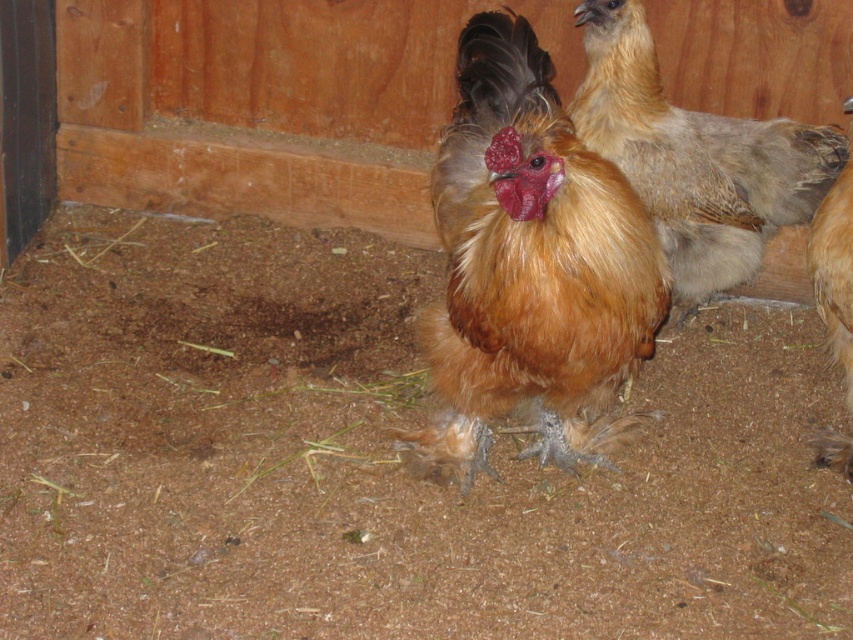
Does golden brown feathered rooster at center have a greater height compared to brown fluffy chicken at right?

Correct, golden brown feathered rooster at center is much taller as brown fluffy chicken at right.

In the scene shown: Who is higher up, golden brown feathered rooster at center or brown fluffy chicken at right?

golden brown feathered rooster at center

Find the location of a particular element. golden brown feathered rooster at center is located at coordinates (531, 268).

Between point (479, 300) and point (593, 115), which one is positioned in front?

Point (479, 300) is in front.

Is point (509, 74) positioned after point (715, 141)?

No, (509, 74) is closer to viewer.

Which is in front, point (608, 348) or point (735, 202)?

Point (608, 348) is in front.

You are a GUI agent. You are given a task and a screenshot of the screen. Output one action in this format:
    pyautogui.click(x=<x>, y=<y>)
    Task: Click on the golden brown feathered rooster at center
    Image resolution: width=853 pixels, height=640 pixels.
    Given the screenshot: What is the action you would take?
    pyautogui.click(x=531, y=268)

Can you confirm if golden feathered chicken at center is thinner than brown fluffy chicken at right?

In fact, golden feathered chicken at center might be wider than brown fluffy chicken at right.

Is point (602, 96) behind point (837, 340)?

Yes, it is behind point (837, 340).

I want to click on golden feathered chicken at center, so click(x=695, y=157).